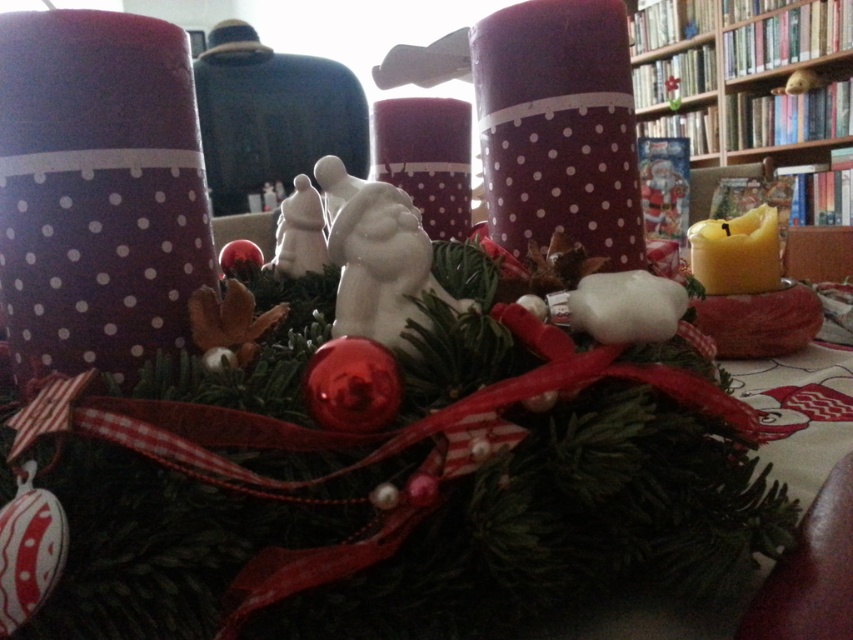
You are standing in front of the festive arrangement and want to place a small gift box exactly 28 inches away from the matte polka dot candle at center. Can you place it in front of or behind the candle?

The matte polka dot candle at center is 25.84 inches away from the viewer. To place the gift box 28 inches away, it should be placed behind the candle since that would increase the distance from the viewer beyond the candle.

You are standing in front of the festive arrangement and want to place a new ornament exactly at the point marked by coordinates point (426, 157). Which object will this new ornament be placed on?

The point (426, 157) corresponds to the matte polka dot candle at center, so the new ornament will be placed on the matte polka dot candle at center.